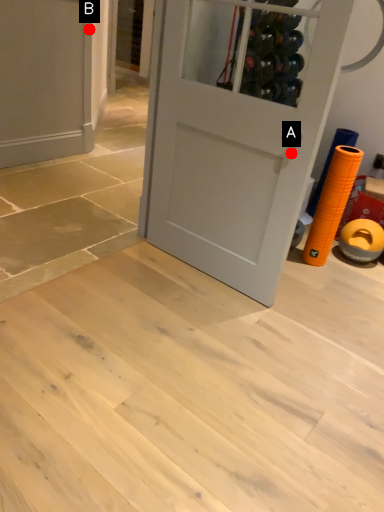
Question: Two points are circled on the image, labeled by A and B beside each circle. Which point is farther from the camera taking this photo?

Choices:
 (A) A is further
 (B) B is further

Answer: (B)